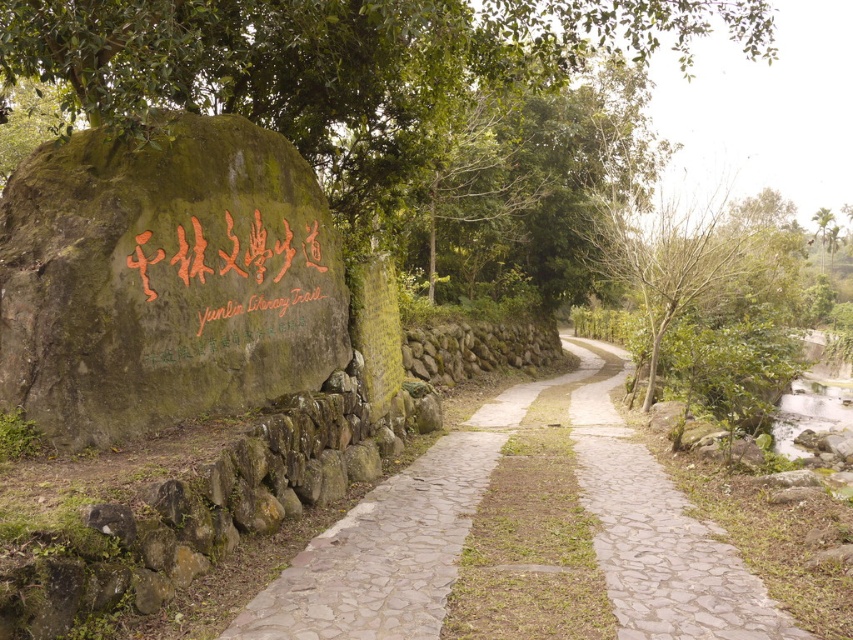
You are standing at the entrance of the Yunlin Literary Trail and want to take a photo that includes both the green leafy tree at upper center and the natural stone path at center. Which object will appear wider in the photo?

The green leafy tree at upper center will appear wider in the photo since its width is larger than the natural stone path at center.

You are a hiker who wants to take a photo of both the green mossy rock at left and the natural stone path at center. Since you have a wide angle lens, which object should you move closer to in order to include both in the frame without cropping?

Since the green mossy rock at left is smaller than the natural stone path at center, you should move closer to the green mossy rock at left to balance their sizes in the photo.

You are a hiker standing on the stone pathway and want to take a photo of both the green mossy rock at left and the green leafy tree at upper center. Which object should you adjust your camera angle to focus on first to ensure both are in frame?

The green mossy rock at left is positioned on the left side of green leafy tree at upper center, so you should focus on the green leafy tree at upper center first to ensure both are in frame.